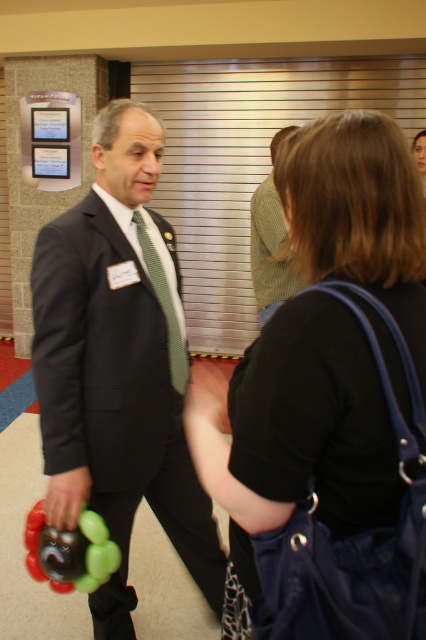
You are standing in the conference room and want to place a new monitor at point (97,497). The monitor requires a minimum distance of 4 feet from the camera to avoid distortion. Will this placement work?

The distance of point (97,497) from the camera is 4.59 feet, which is greater than the required 4 feet. Therefore, placing the monitor at point (97,497) will work to avoid distortion.

You are standing in the conference room and want to take a photo of both the point at coordinates point (x=241, y=550) and point (x=252, y=200). Which point should you focus on first to ensure both are in focus?

You should focus on point (x=241, y=550) first because it is closer to the camera than point (x=252, y=200), ensuring both points are within the depth of field.

You are a photographer setting up for a group photo. You have two subjects wearing the matte black suit at center and the green knitted sweater at center. Based on their positions and the space available, which subject should you position closer to the edges to avoid overcrowding the frame?

The matte black suit at center should be positioned closer to the edges since it is wider than the green knitted sweater at center, which is narrower. This arrangement will help balance the composition and prevent overcrowding.